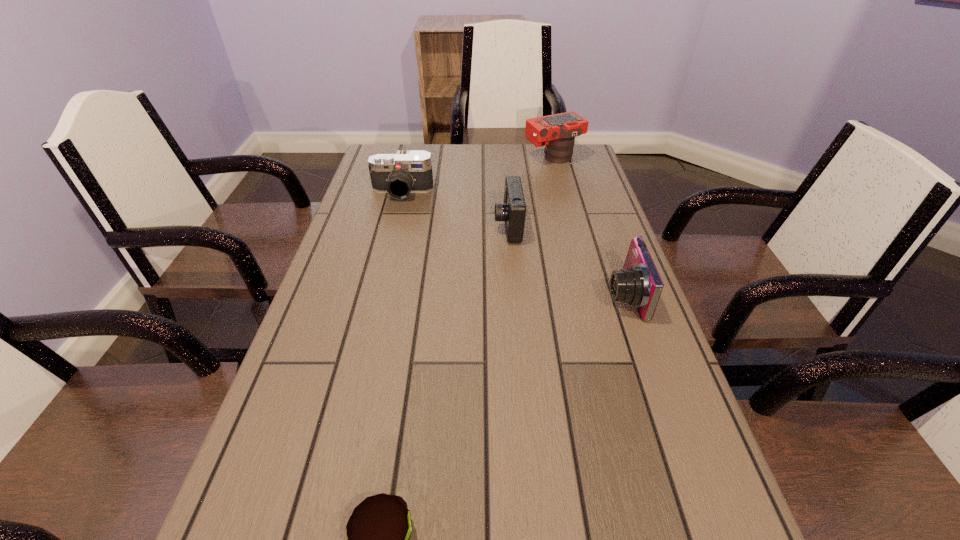
At what (x,y) coordinates should I click in order to perform the action: click on blank space at the right edge of the desktop. Please return your answer as a coordinate pair (x, y). This screenshot has width=960, height=540. Looking at the image, I should click on (674, 374).

You are a GUI agent. You are given a task and a screenshot of the screen. Output one action in this format:
    pyautogui.click(x=<x>, y=<y>)
    Task: Click on the empty location between the second farthest camera and the nearest camera
    The width and height of the screenshot is (960, 540).
    Given the screenshot: What is the action you would take?
    pyautogui.click(x=513, y=244)

The image size is (960, 540). Identify the location of free point between the farthest camera and the nearest camera. (588, 227).

Where is `vacant point located between the third nearest camera and the second nearest camera`? Image resolution: width=960 pixels, height=540 pixels. vacant point located between the third nearest camera and the second nearest camera is located at coordinates (455, 209).

I want to click on object that is the closest one to the tallest object, so click(513, 210).

Locate which object is the fourth closest to the leftmost camera. Please provide its 2D coordinates. Your answer should be formatted as a tuple, i.e. [(x, y)], where the tuple contains the x and y coordinates of a point satisfying the conditions above.

[(378, 531)]

Locate which camera is the closest to the fourth nearest object. Please provide its 2D coordinates. Your answer should be formatted as a tuple, i.e. [(x, y)], where the tuple contains the x and y coordinates of a point satisfying the conditions above.

[(513, 210)]

Locate which camera is the closest to the third nearest camera. Please provide its 2D coordinates. Your answer should be formatted as a tuple, i.e. [(x, y)], where the tuple contains the x and y coordinates of a point satisfying the conditions above.

[(513, 210)]

The image size is (960, 540). What are the coordinates of `free space that satisfies the following two spatial constraints: 1. on the front side of the tallest camera; 2. on the front-facing side of the third object from right to left` in the screenshot? It's located at (570, 226).